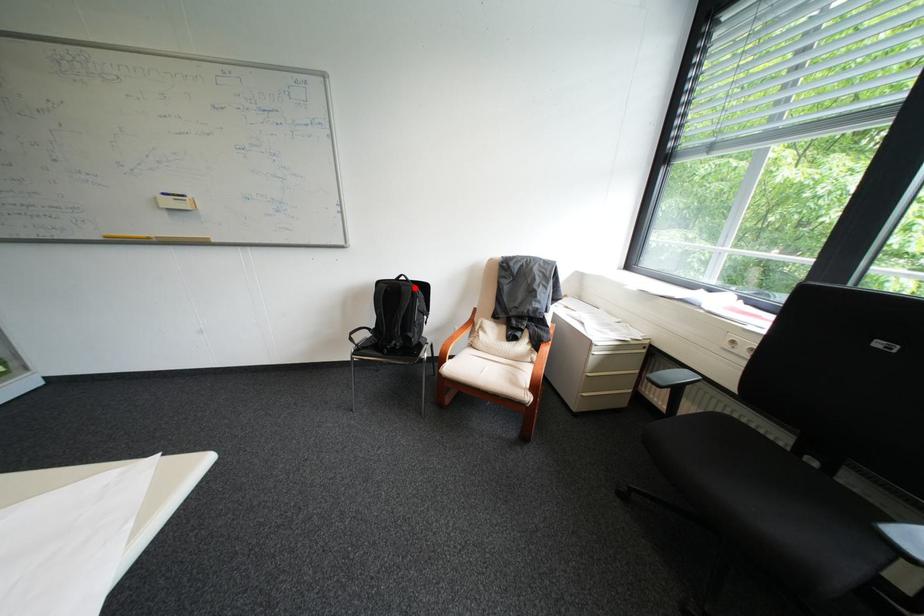
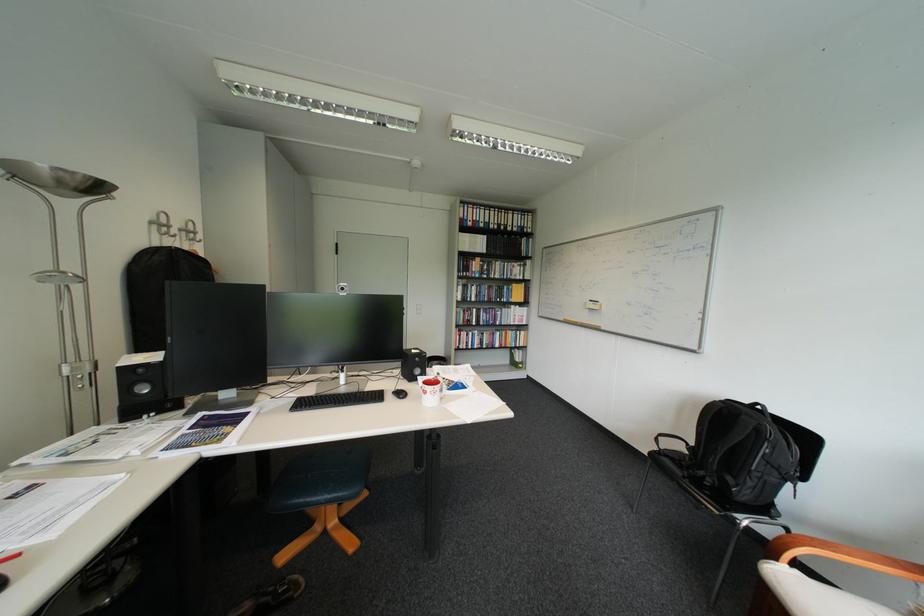
Find the pixel in the second image that matches the highlighted location in the first image.

(756, 418)